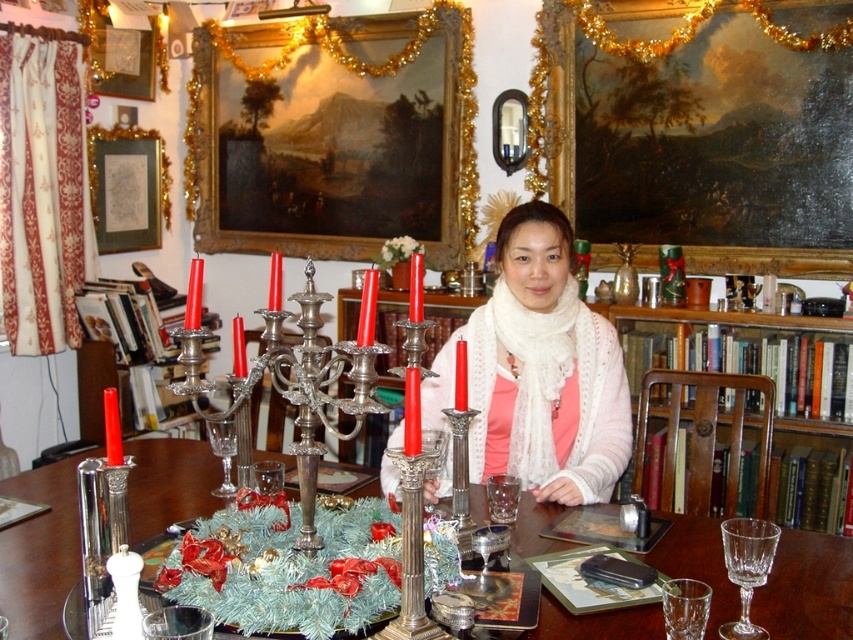
Question: Can you confirm if gold ornate frame at upper left is positioned to the right of clear glass wine glass at center?

Choices:
 (A) yes
 (B) no

Answer: (B)

Question: Estimate the real-world distances between objects in this image. Which object is closer to the clear glass wine glass at center?

Choices:
 (A) wooden bookshelf at center
 (B) white knitted scarf at center

Answer: (B)

Question: Can you confirm if gold gilded picture frame at upper center is positioned to the right of white knitted scarf at center?

Choices:
 (A) yes
 (B) no

Answer: (A)

Question: From the image, what is the correct spatial relationship of white knitted scarf at center in relation to gold ornate frame at upper left?

Choices:
 (A) right
 (B) left

Answer: (A)

Question: Which object appears closest to the camera in this image?

Choices:
 (A) gold gilded picture frame at upper center
 (B) metallic silver table at center
 (C) gold ornate frame at upper left

Answer: (B)

Question: Among these points, which one is nearest to the camera?

Choices:
 (A) (706, 611)
 (B) (766, 531)

Answer: (A)